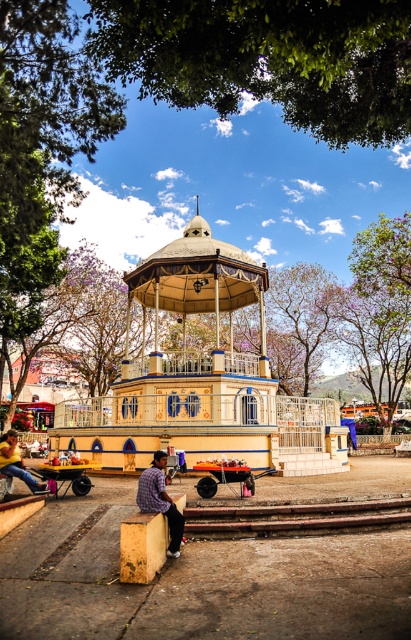
Question: From the image, what is the correct spatial relationship of plaid shirt at lower center in relation to denim pants at lower left?

Choices:
 (A) left
 (B) right

Answer: (B)

Question: Which of the following is the farthest from the observer?

Choices:
 (A) (168, 65)
 (B) (25, 474)
 (C) (404, 516)
 (D) (173, 536)

Answer: (A)

Question: Does green leafy canopy at upper center appear on the left side of rusty metal train track at lower center?

Choices:
 (A) yes
 (B) no

Answer: (A)

Question: Which object is positioned closest to the plaid shirt at lower center?

Choices:
 (A) beige painted wood gazebo at center
 (B) green leafy canopy at upper center

Answer: (B)

Question: Does beige painted wood gazebo at center appear under denim pants at lower left?

Choices:
 (A) yes
 (B) no

Answer: (B)

Question: Which of the following is the closest to the observer?

Choices:
 (A) beige painted wood gazebo at center
 (B) denim pants at lower left

Answer: (B)